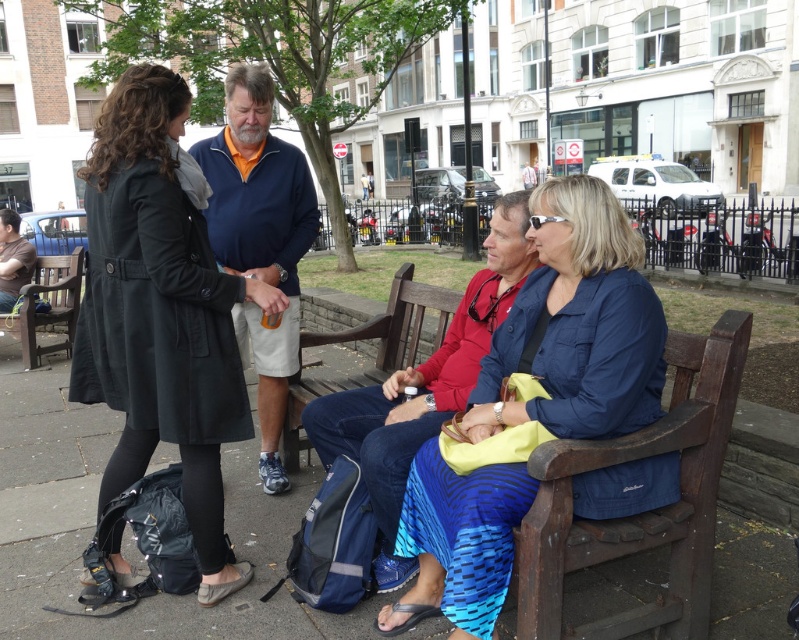
Does blue fleece at center appear under brown wooden bench at center?

No.

Who is more distant from viewer, (201, 154) or (303, 387)?

The point (303, 387) is more distant.

Where is `blue fleece at center`? blue fleece at center is located at coordinates click(x=260, y=240).

Is blue woven skirt at center bigger than black matte coat at left?

No.

Can you confirm if blue woven skirt at center is positioned to the right of black matte coat at left?

Yes, blue woven skirt at center is to the right of black matte coat at left.

Is point (652, 339) less distant than point (181, 161)?

That is True.

Where is `blue woven skirt at center`? The height and width of the screenshot is (640, 799). blue woven skirt at center is located at coordinates (575, 324).

Does blue woven skirt at center have a greater height compared to blue fleece at center?

No.

What do you see at coordinates (575, 324) in the screenshot? I see `blue woven skirt at center` at bounding box center [575, 324].

Find the location of a particular element. The width and height of the screenshot is (799, 640). blue woven skirt at center is located at coordinates (575, 324).